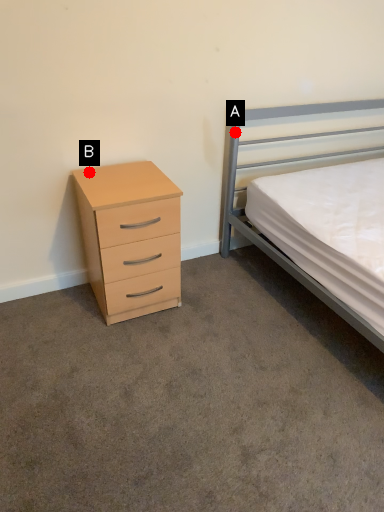
Question: Two points are circled on the image, labeled by A and B beside each circle. Which of the following is the closest to the observer?

Choices:
 (A) A is closer
 (B) B is closer

Answer: (B)